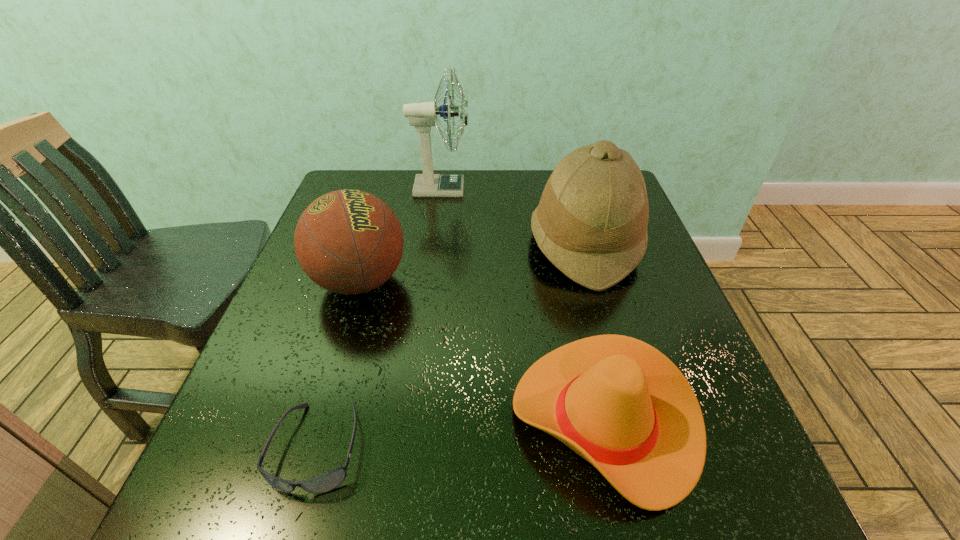
Find the location of a particular element. The width and height of the screenshot is (960, 540). object at the far right corner is located at coordinates (591, 223).

Identify the location of object present at the near right corner. The image size is (960, 540). (619, 403).

Locate an element on the screen. This screenshot has height=540, width=960. vacant area at the far edge of the desktop is located at coordinates (483, 189).

Locate an element on the screen. vacant space at the near edge of the desktop is located at coordinates (557, 530).

The width and height of the screenshot is (960, 540). Find the location of `free space at the left edge of the desktop`. free space at the left edge of the desktop is located at coordinates (348, 318).

In the image, there is a desktop. Identify the location of vacant space at the right edge. (620, 308).

Identify the location of vacant area at the far left corner. (381, 177).

Locate an element on the screen. empty space between the third shortest object and the fourth tallest object is located at coordinates (483, 350).

Image resolution: width=960 pixels, height=540 pixels. What are the coordinates of `empty location between the fourth tallest object and the third tallest object` in the screenshot? It's located at (483, 350).

Locate an element on the screen. Image resolution: width=960 pixels, height=540 pixels. vacant space that's between the hat and the fourth tallest object is located at coordinates (595, 332).